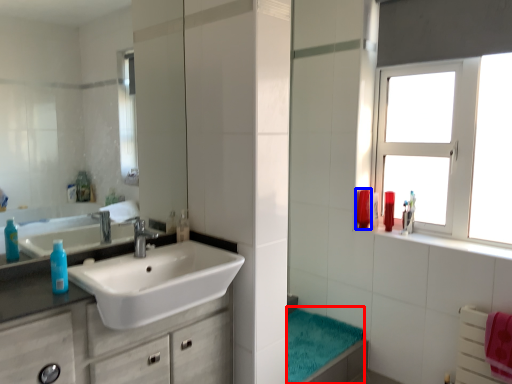
Question: Which of the following is the farthest to the observer, bath towel (highlighted by a red box) or mouthwash (highlighted by a blue box)?

Choices:
 (A) bath towel
 (B) mouthwash

Answer: (B)